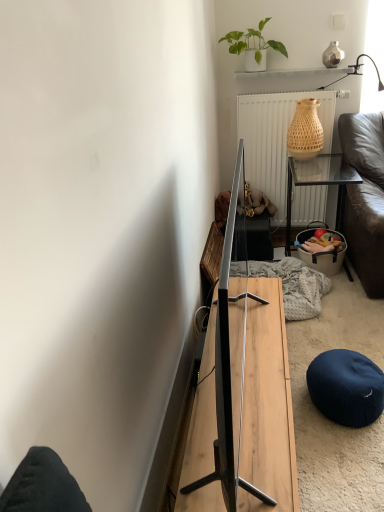
The height and width of the screenshot is (512, 384). In order to click on empty space that is ontop of dark blue fabric stool at lower right in this screenshot , I will do `click(349, 370)`.